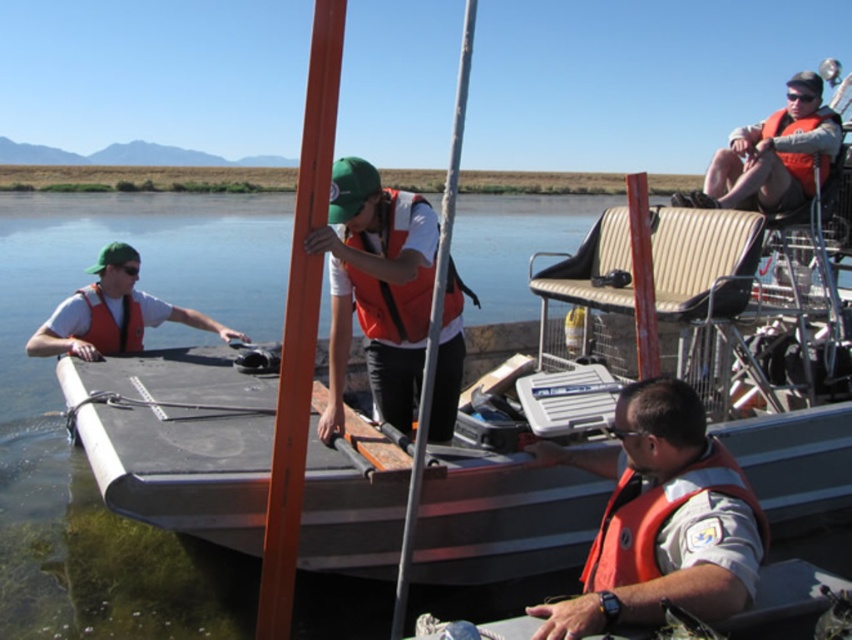
Does matte orange life jacket at left come behind orange life jacket at upper right?

Yes, it is behind orange life jacket at upper right.

Which is in front, point (139, 332) or point (792, 132)?

Positioned in front is point (792, 132).

Where is `matte orange life jacket at left`? matte orange life jacket at left is located at coordinates (111, 323).

Who is more forward, (148, 300) or (795, 179)?

Point (795, 179) is in front.

From the picture: Who is taller, matte orange life vest at left or orange life jacket at upper right?

With more height is matte orange life vest at left.

Find the location of a particular element. The image size is (852, 640). matte orange life vest at left is located at coordinates (112, 314).

Can you confirm if matte orange life vest at center is positioned above orange life jacket at lower right?

Yes.

Between matte orange life vest at center and orange life jacket at lower right, which one is positioned higher?

matte orange life vest at center is higher up.

Between point (349, 291) and point (701, 480), which one is positioned behind?

The point (349, 291) is behind.

Find the location of a particular element. matte orange life vest at center is located at coordinates (377, 289).